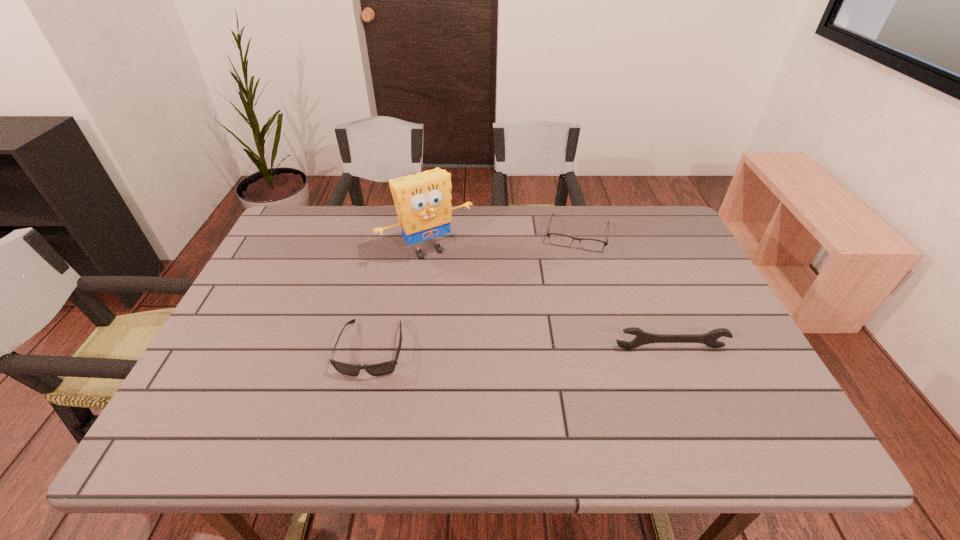
In order to click on empty location between the sunglasses and the third shortest object in this screenshot , I will do `click(521, 348)`.

Identify the location of vacant space in between the third shortest object and the sponge. This screenshot has height=540, width=960. (549, 299).

Locate which object is the closest to the wrench. Please provide its 2D coordinates. Your answer should be formatted as a tuple, i.e. [(x, y)], where the tuple contains the x and y coordinates of a point satisfying the conditions above.

[(557, 239)]

Identify the location of object that is the third closest to the wrench. This screenshot has width=960, height=540. (384, 368).